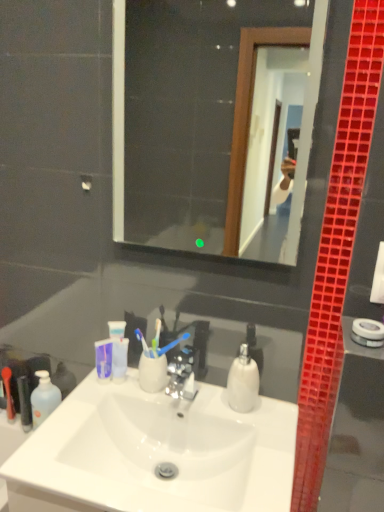
Image resolution: width=384 pixels, height=512 pixels. In order to click on vacant space in front of white glossy soap dispenser at center in this screenshot , I will do `click(264, 457)`.